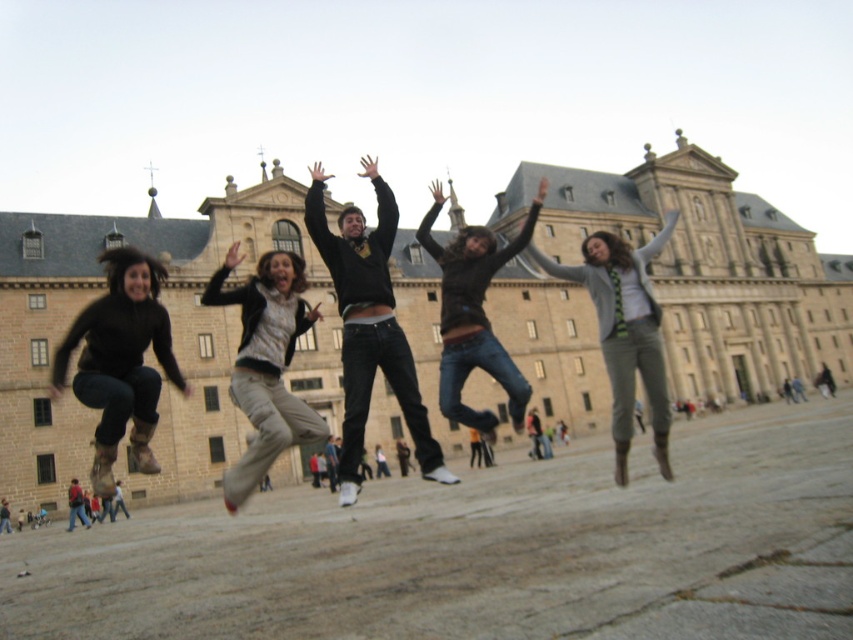
Question: Is matte black sweater at left in front of jeans at center?

Choices:
 (A) no
 (B) yes

Answer: (B)

Question: Estimate the real-world distances between objects in this image. Which object is closer to the brown stone building at center?

Choices:
 (A) light gray knit sweater at center
 (B) dark gray hoodie at center
 (C) red jacket at lower left
 (D) matte black sweater at left

Answer: (A)

Question: Considering the relative positions of smooth stone ground at center and jeans at center in the image provided, where is smooth stone ground at center located with respect to jeans at center?

Choices:
 (A) above
 (B) below

Answer: (B)

Question: Which point appears farthest from the camera in this image?

Choices:
 (A) [450, 328]
 (B) [792, 576]
 (C) [79, 512]

Answer: (A)

Question: Is brown stone building at center above light gray knit sweater at center?

Choices:
 (A) no
 (B) yes

Answer: (B)

Question: Which point is closer to the camera?

Choices:
 (A) brown stone building at center
 (B) jeans at center

Answer: (A)